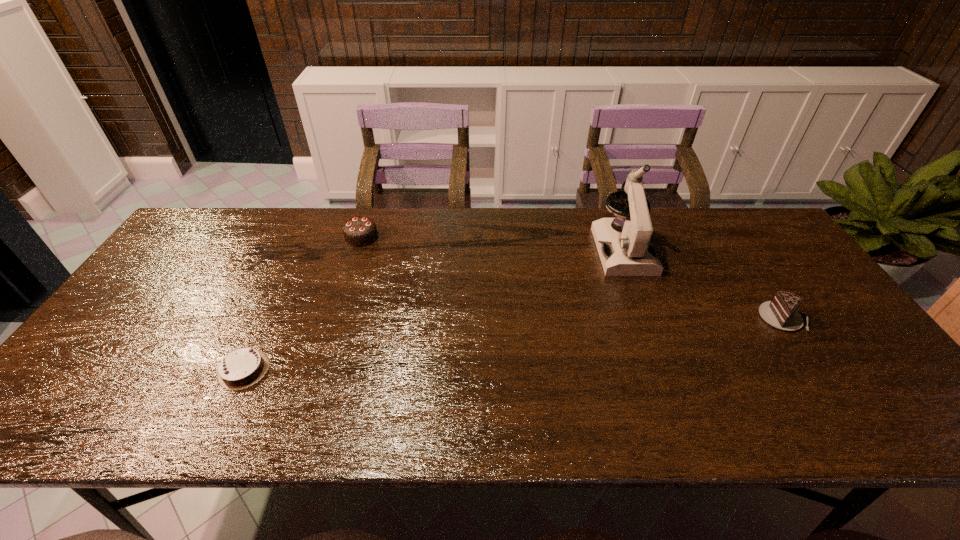
Where is `free space that is in between the leftmost chocolate cake and the tallest chocolate cake`? free space that is in between the leftmost chocolate cake and the tallest chocolate cake is located at coordinates (302, 303).

Where is `free space between the second tallest object and the rightmost object`? This screenshot has width=960, height=540. free space between the second tallest object and the rightmost object is located at coordinates (572, 278).

Where is `vacant area between the second nearest object and the third shortest object`? The width and height of the screenshot is (960, 540). vacant area between the second nearest object and the third shortest object is located at coordinates (572, 278).

Locate an element on the screen. The width and height of the screenshot is (960, 540). vacant space in between the second object from right to left and the third object from right to left is located at coordinates (492, 244).

At what (x,y) coordinates should I click in order to perform the action: click on blank region between the nearest object and the second chocolate cake from right to left. Please return your answer as a coordinate pair (x, y). This screenshot has width=960, height=540. Looking at the image, I should click on (302, 303).

Locate an element on the screen. The image size is (960, 540). blank region between the second tallest object and the third farthest object is located at coordinates (572, 278).

Find the location of a particular element. This screenshot has height=540, width=960. vacant space that is in between the second shortest chocolate cake and the second chocolate cake from left to right is located at coordinates (572, 278).

The width and height of the screenshot is (960, 540). I want to click on empty space between the tallest object and the third farthest object, so tap(703, 284).

Identify the location of free space between the nearest object and the microscope. (434, 309).

Identify which object is the second closest to the tallest chocolate cake. Please provide its 2D coordinates. Your answer should be formatted as a tuple, i.e. [(x, y)], where the tuple contains the x and y coordinates of a point satisfying the conditions above.

[(630, 252)]